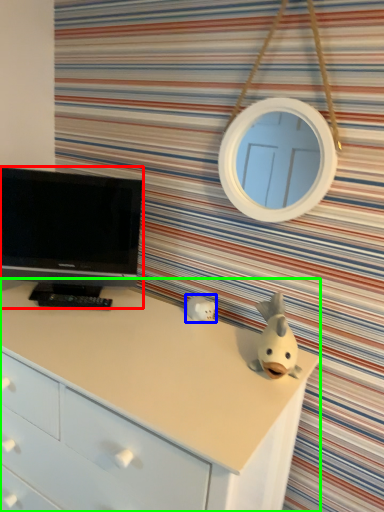
Question: Which object is positioned farthest from television (highlighted by a red box)? Select from toy (highlighted by a blue box) and chest of drawers (highlighted by a green box).

Choices:
 (A) toy
 (B) chest of drawers

Answer: (A)